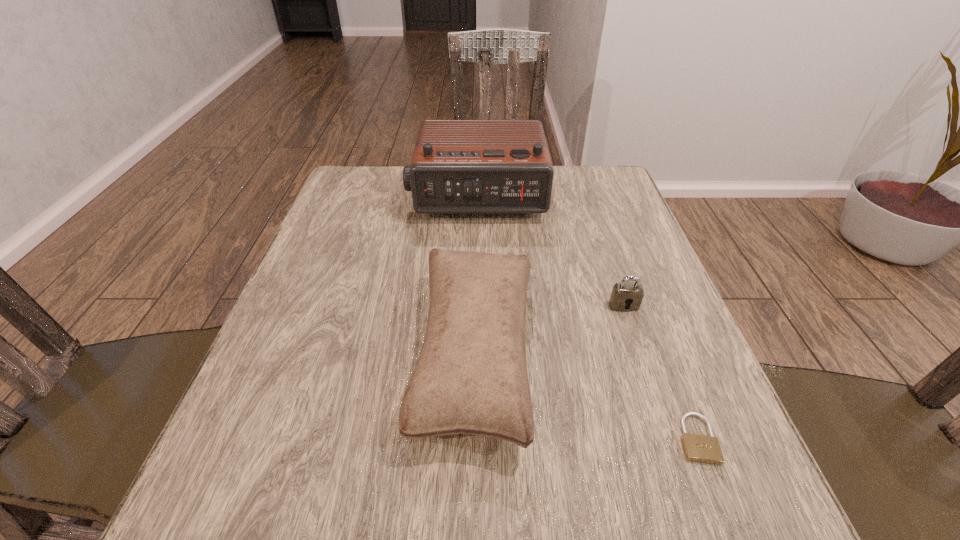
At what (x,y) coordinates should I click in order to perform the action: click on vacant position in the image that satisfies the following two spatial constraints: 1. at the front of the shorter padlock near the keyhole; 2. on the right side of the second shortest object. Please return your answer as a coordinate pair (x, y). The image size is (960, 540). Looking at the image, I should click on click(668, 438).